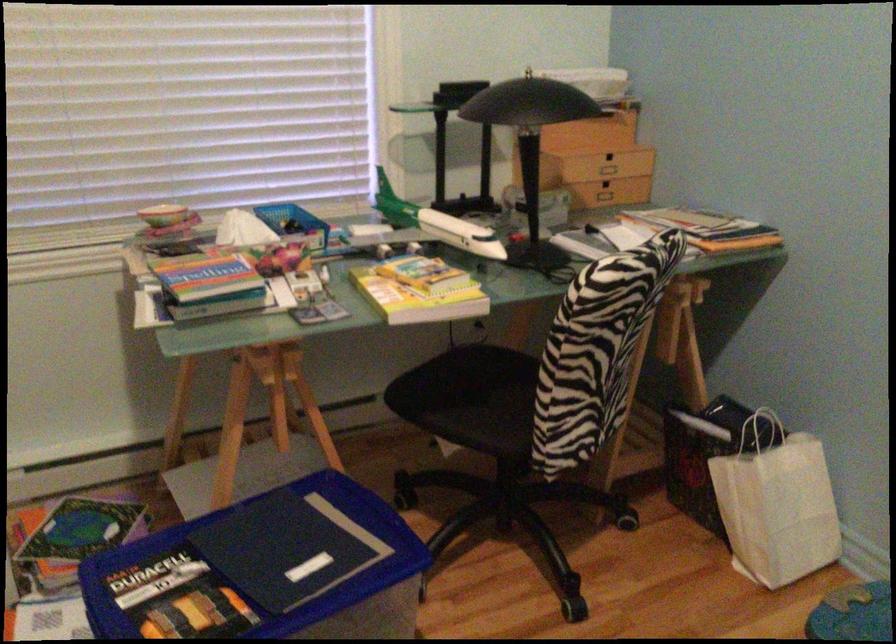
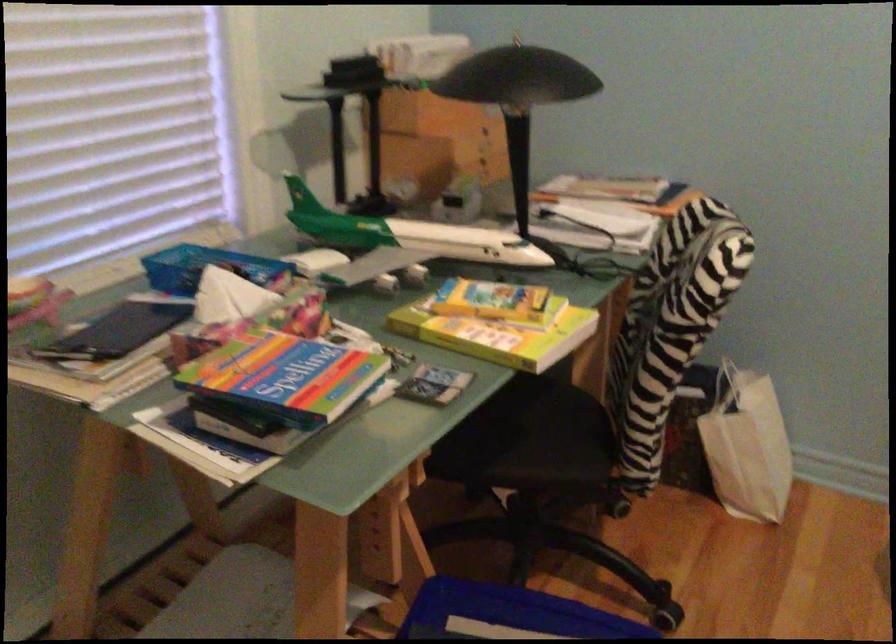
In the second image, find the point that corresponds to (x=352, y=506) in the first image.

(507, 614)